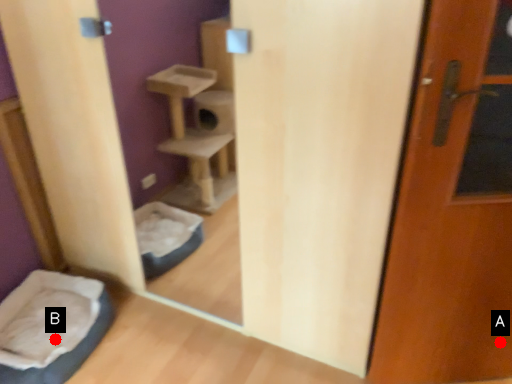
Question: Two points are circled on the image, labeled by A and B beside each circle. Which point appears farthest from the camera in this image?

Choices:
 (A) A is further
 (B) B is further

Answer: (B)